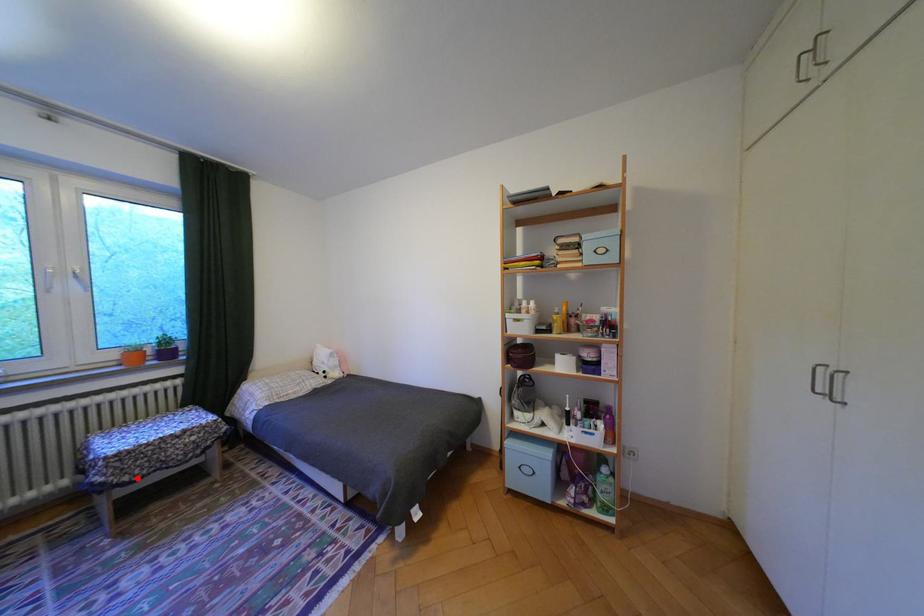
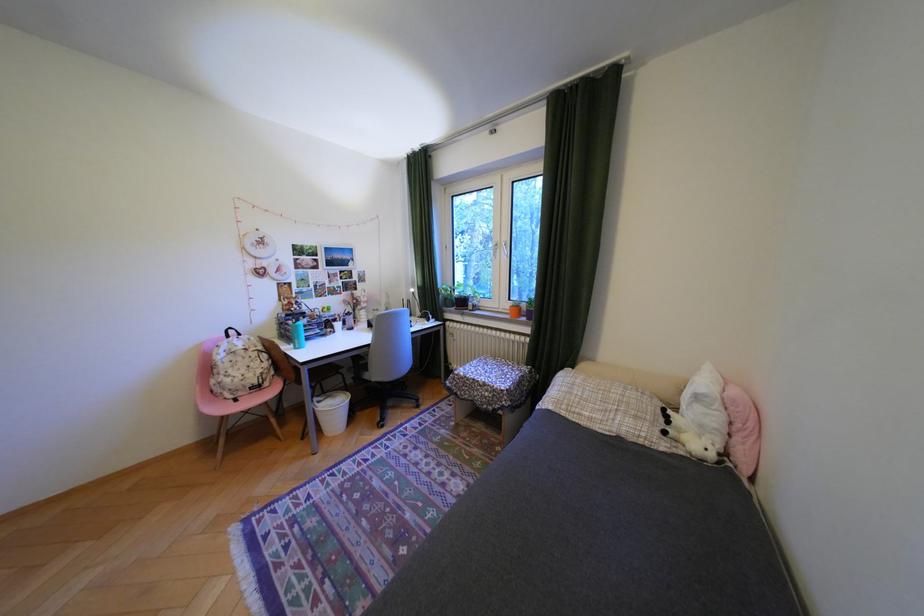
Question: I am providing you with two images of the same scene from different viewpoints. In image1, a red point is highlighted. Considering the same 3D point in image2, which of the following is correct?

Choices:
 (A) It is closer
 (B) It is farther

Answer: (B)